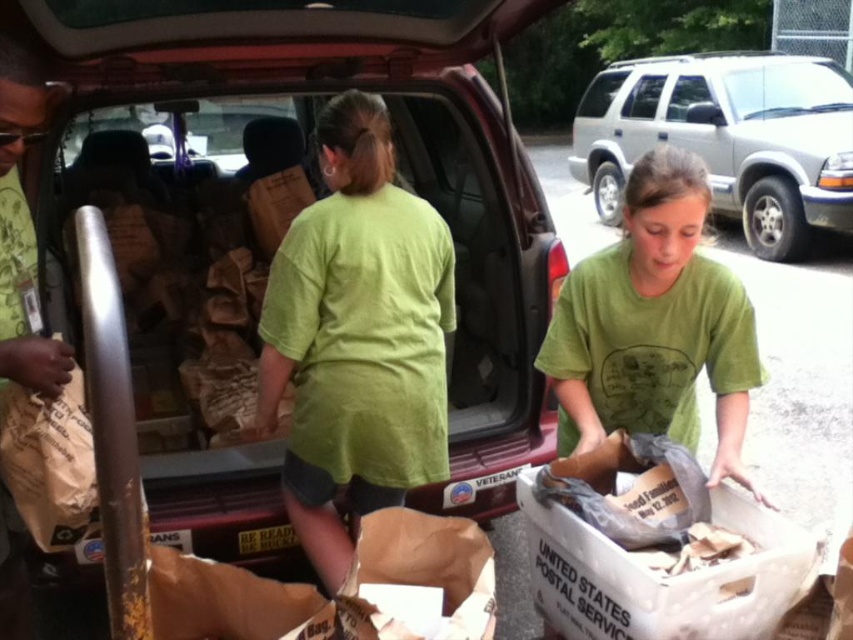
You are a volunteer helping to organize items in the trunk of the red vehicle. You need to place the matte brown paper bag at center and the green cotton shirt at center into the trunk. Which item should you place first to ensure proper fitting?

You should place the matte brown paper bag at center first because it might be wider than the green cotton shirt at center, so placing the larger item first allows for better organization in the trunk.

You are a volunteer at the event and need to quickly move from the green cotton shirt at center to the silver metallic minivan at upper right. Considering the distance between them, can you estimate how many seconds it would take you to walk there at a normal pace?

The distance between the green cotton shirt at center and the silver metallic minivan at upper right is 5.23 meters. At a normal walking speed of approximately 1.4 meters per second, it would take roughly 3.7 seconds to cover that distance.